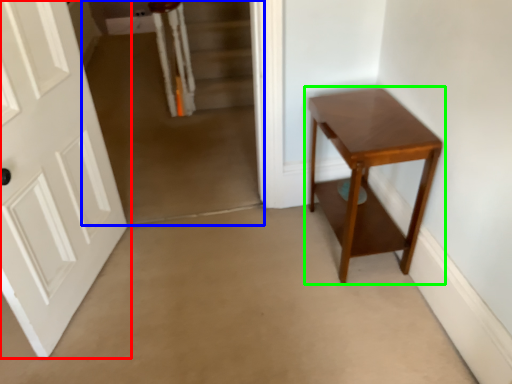
Question: Which object is positioned farthest from door (highlighted by a red box)? Select from corridor (highlighted by a blue box) and table (highlighted by a green box).

Choices:
 (A) corridor
 (B) table

Answer: (B)